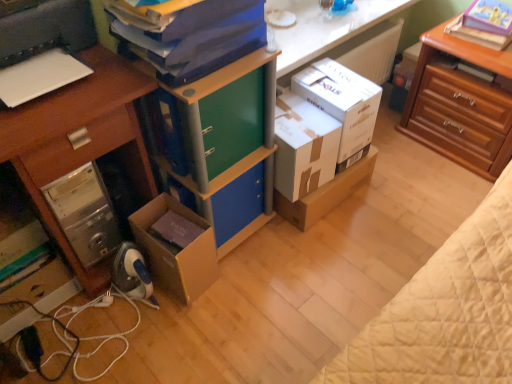
This screenshot has height=384, width=512. What are the coordinates of `spots to the right of cardboard box at lower left, acting as the 3th box starting from the right` in the screenshot? It's located at (245, 274).